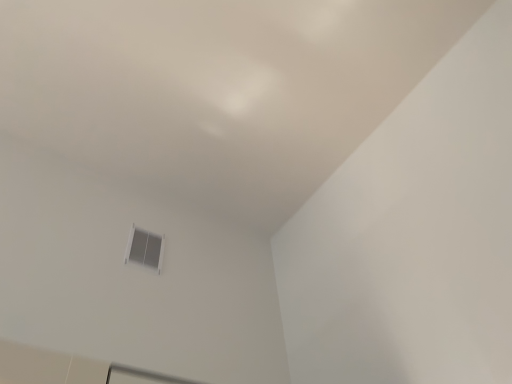
Describe the element at coordinates (145, 249) in the screenshot. The image size is (512, 384). I see `white matte window at center` at that location.

Measure the distance between point (x=150, y=237) and camera.

Point (x=150, y=237) is 2.08 meters away from camera.

In order to click on white matte window at center in this screenshot , I will do [145, 249].

Where is `white matte window at center`? Image resolution: width=512 pixels, height=384 pixels. white matte window at center is located at coordinates (145, 249).